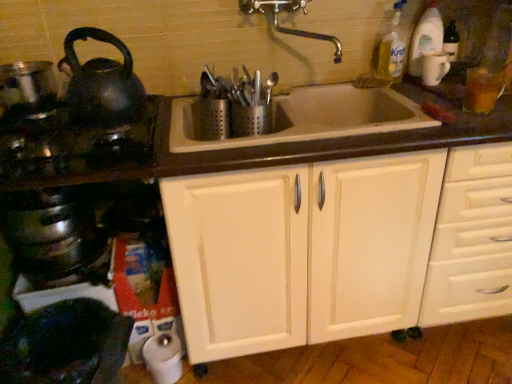
In order to face brass metallic faucet at upper center, should I rotate leftwards or rightwards?

You should rotate right by 4.925 degrees.

The height and width of the screenshot is (384, 512). What do you see at coordinates (289, 11) in the screenshot?
I see `brass metallic faucet at upper center` at bounding box center [289, 11].

The width and height of the screenshot is (512, 384). I want to click on shiny metallic pot at left, so click(27, 83).

This screenshot has width=512, height=384. What do you see at coordinates (434, 68) in the screenshot?
I see `white glossy mug at upper right` at bounding box center [434, 68].

Where is `shiny metallic crock pot at lower left`? This screenshot has width=512, height=384. shiny metallic crock pot at lower left is located at coordinates (52, 234).

The height and width of the screenshot is (384, 512). What do you see at coordinates (52, 234) in the screenshot?
I see `shiny metallic crock pot at lower left` at bounding box center [52, 234].

What are the coordinates of `white plastic bottle at upper right, the 2th bottle when ordered from left to right` in the screenshot? It's located at (428, 48).

This screenshot has height=384, width=512. What do you see at coordinates (102, 84) in the screenshot? I see `shiny black kettle at left` at bounding box center [102, 84].

What are the coordinates of `brass metallic faucet at upper center` in the screenshot? It's located at (289, 11).

Based on the photo, who is taller, white ceramic sink at center or brass metallic faucet at upper center?

brass metallic faucet at upper center is taller.

Does white ceramic sink at center have a smaller size compared to brass metallic faucet at upper center?

No.

Does point (350, 90) lie behind point (273, 3)?

Yes, it is.

From the image's perspective, is white ceramic sink at center located above or below brass metallic faucet at upper center?

Clearly, from the image's perspective, white ceramic sink at center is below brass metallic faucet at upper center.

Considering the positions of objects white wood cabinet at center and shiny metallic pot at left in the image provided, who is behind, white wood cabinet at center or shiny metallic pot at left?

shiny metallic pot at left is behind.

This screenshot has height=384, width=512. There is a white wood cabinet at center. Find the location of `kitchen appliance above it (from a real-world perspective)`. kitchen appliance above it (from a real-world perspective) is located at coordinates (27, 83).

In the scene shown: Is white wood cabinet at center facing towards shiny metallic pot at left?

No, white wood cabinet at center is not oriented towards shiny metallic pot at left.

Is shiny black kettle at left facing towards brass metallic faucet at upper center?

No, shiny black kettle at left is not facing towards brass metallic faucet at upper center.

Considering the sizes of shiny black kettle at left and brass metallic faucet at upper center in the image, is shiny black kettle at left bigger or smaller than brass metallic faucet at upper center?

Clearly, shiny black kettle at left is larger in size than brass metallic faucet at upper center.

Are shiny black kettle at left and brass metallic faucet at upper center making contact?

No, shiny black kettle at left is not making contact with brass metallic faucet at upper center.

Is shiny black kettle at left positioned beyond the bounds of brass metallic faucet at upper center?

shiny black kettle at left is positioned outside brass metallic faucet at upper center.

Could you tell me if brass metallic faucet at upper center is facing white wood cabinet at center?

No, brass metallic faucet at upper center is not aimed at white wood cabinet at center.

Considering the relative sizes of brass metallic faucet at upper center and white wood cabinet at center in the image provided, is brass metallic faucet at upper center bigger than white wood cabinet at center?

Incorrect, brass metallic faucet at upper center is not larger than white wood cabinet at center.

Would you say brass metallic faucet at upper center is outside white wood cabinet at center?

Yes, brass metallic faucet at upper center is located beyond the bounds of white wood cabinet at center.

How different are the orientations of brass metallic faucet at upper center and white wood cabinet at center in degrees?

brass metallic faucet at upper center and white wood cabinet at center are facing 0.358 degrees away from each other.

Considering the sizes of objects shiny metallic crock pot at lower left and white glossy mug at upper right in the image provided, who is taller, shiny metallic crock pot at lower left or white glossy mug at upper right?

white glossy mug at upper right is taller.

Who is bigger, shiny metallic crock pot at lower left or white glossy mug at upper right?

shiny metallic crock pot at lower left.

Would you say shiny metallic crock pot at lower left contains white glossy mug at upper right?

No, white glossy mug at upper right is not a part of shiny metallic crock pot at lower left.

Can you confirm if shiny metallic crock pot at lower left is positioned to the left of white glossy mug at upper right?

Yes, shiny metallic crock pot at lower left is to the left of white glossy mug at upper right.

From the picture: Looking at the image, does brass metallic faucet at upper center seem bigger or smaller compared to shiny metallic crock pot at lower left?

Clearly, brass metallic faucet at upper center is larger in size than shiny metallic crock pot at lower left.

Is brass metallic faucet at upper center taller than shiny metallic crock pot at lower left?

Indeed, brass metallic faucet at upper center has a greater height compared to shiny metallic crock pot at lower left.

Which is behind, point (339, 43) or point (34, 243)?

The point (339, 43) is farther.

Which is more to the left, brass metallic faucet at upper center or shiny metallic crock pot at lower left?

shiny metallic crock pot at lower left is more to the left.

From the picture: Can you confirm if shiny black kettle at left is positioned to the left of brass metallic faucet at upper center?

Correct, you'll find shiny black kettle at left to the left of brass metallic faucet at upper center.

Find the location of a particular element. The height and width of the screenshot is (384, 512). tea pot located on the left of brass metallic faucet at upper center is located at coordinates (102, 84).

Is shiny black kettle at left inside the boundaries of brass metallic faucet at upper center, or outside?

shiny black kettle at left is located beyond the bounds of brass metallic faucet at upper center.

Is the surface of shiny black kettle at left in direct contact with brass metallic faucet at upper center?

There is a gap between shiny black kettle at left and brass metallic faucet at upper center.

Identify the location of tap above the white ceramic sink at center (from a real-world perspective). (289, 11).

The image size is (512, 384). In order to click on cabinetry on the right of shiny metallic pot at left in this screenshot , I will do `click(328, 251)`.

Which object lies further to the anchor point shiny black kettle at left, white ceramic sink at center or shiny black kettle at left?

white ceramic sink at center is further to shiny black kettle at left.

Based on their spatial positions, is white glossy mug at upper right or white plastic bottle at upper right, the 2th bottle when ordered from left to right, further from shiny metallic pot at left?

white glossy mug at upper right is positioned further to the anchor shiny metallic pot at left.

From the image, which object appears to be farther from shiny metallic pot at left, shiny black kettle at left or brass metallic faucet at upper center?

The object further to shiny metallic pot at left is brass metallic faucet at upper center.

Estimate the real-world distances between objects in this image. Which object is further from shiny metallic crock pot at lower left, white wood cabinet at center or brass metallic faucet at upper center?

Based on the image, brass metallic faucet at upper center appears to be further to shiny metallic crock pot at lower left.

Consider the image. Estimate the real-world distances between objects in this image. Which object is closer to brass metallic faucet at upper center, white wood cabinet at center or shiny black kettle at left?

shiny black kettle at left.

Based on their spatial positions, is white wood cabinet at center or shiny metallic crock pot at lower left further from white ceramic sink at center?

shiny metallic crock pot at lower left is positioned further to the anchor white ceramic sink at center.

Estimate the real-world distances between objects in this image. Which object is closer to shiny metallic crock pot at lower left, white plastic bottle at upper right, which ranks as the 1th bottle in right-to-left order, or white ceramic sink at center?

Among the two, white ceramic sink at center is located nearer to shiny metallic crock pot at lower left.

In the scene shown: Considering their positions, is white ceramic sink at center positioned closer to white wood cabinet at center than yellow plastic bottle at upper right, which is the first bottle in left-to-right order?

white ceramic sink at center is closer to white wood cabinet at center.

Image resolution: width=512 pixels, height=384 pixels. Identify the location of bottle between shiny black kettle at left and white plastic bottle at upper right, which ranks as the 1th bottle in right-to-left order. (392, 45).

I want to click on sink situated between shiny black kettle at left and yellow plastic bottle at upper right, which is the first bottle in left-to-right order, from left to right, so click(309, 117).

You are a GUI agent. You are given a task and a screenshot of the screen. Output one action in this format:
    pyautogui.click(x=<x>, y=<y>)
    Task: Click on the bottle between shiny black kettle at left and white glossy mug at upper right in the horizontal direction
    The image size is (512, 384).
    Given the screenshot: What is the action you would take?
    pyautogui.click(x=392, y=45)

Identify the location of bottle between shiny metallic crock pot at lower left and white glossy mug at upper right from left to right. (392, 45).